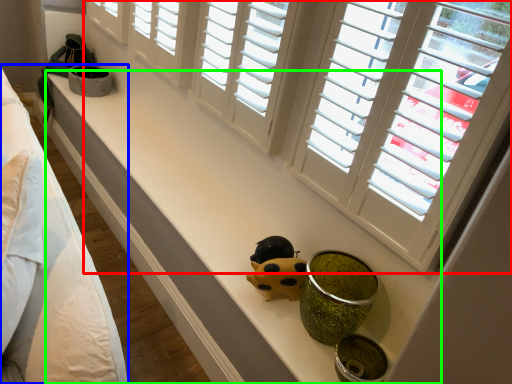
Question: Which is farther away from window (highlighted by a red box)? bed (highlighted by a blue box) or counter top (highlighted by a green box)?

Choices:
 (A) bed
 (B) counter top

Answer: (A)